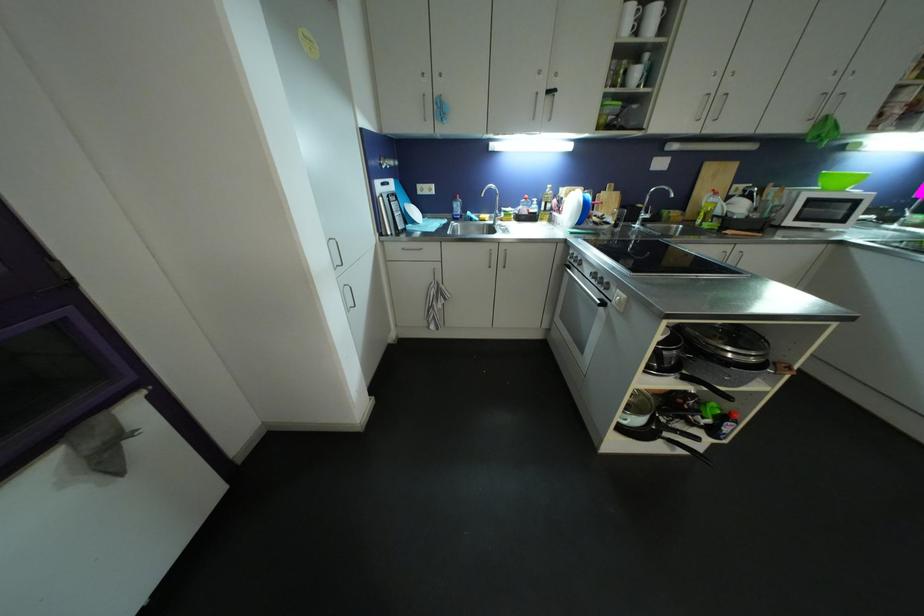
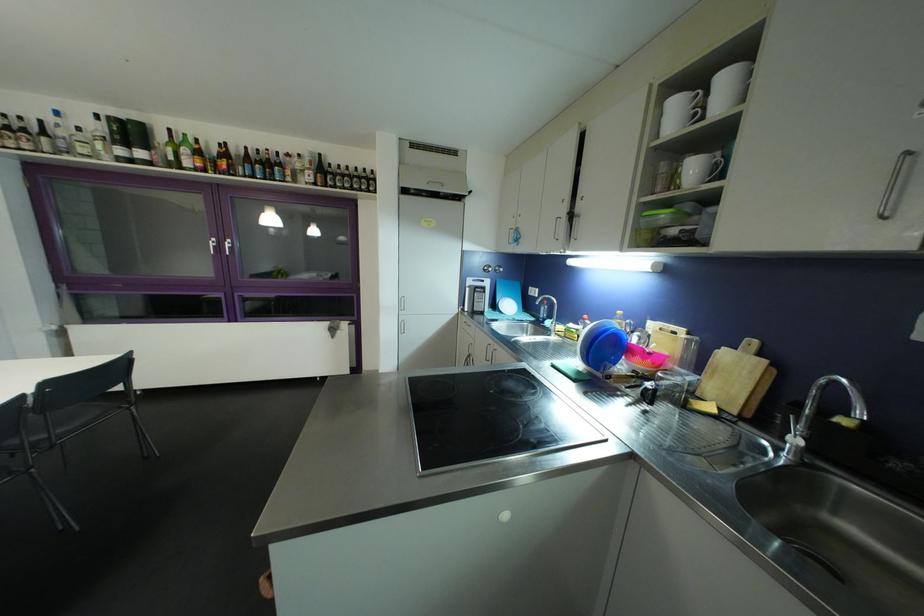
Find the pixel in the second image that matches point 610,198 in the first image.

(732, 358)